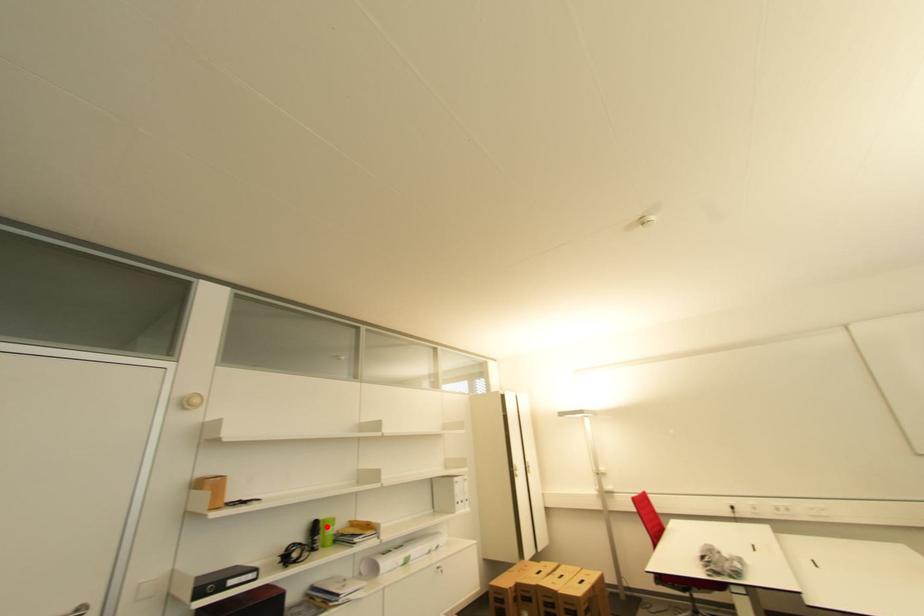
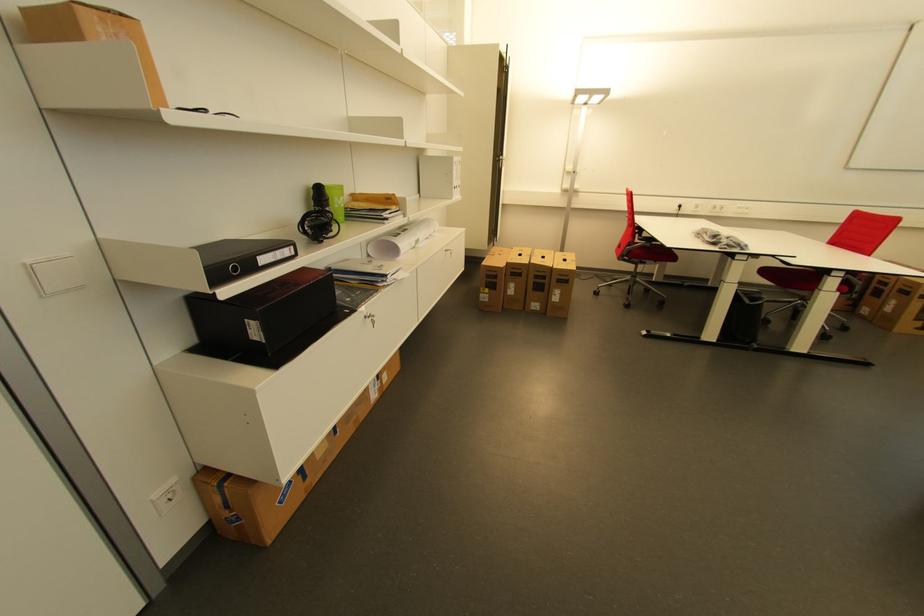
Question: I am providing you with two images of the same scene from different viewpoints. Given a red point in image1, look at the same physical point in image2. Is it:

Choices:
 (A) Closer to the viewpoint
 (B) Farther from the viewpoint

Answer: (A)